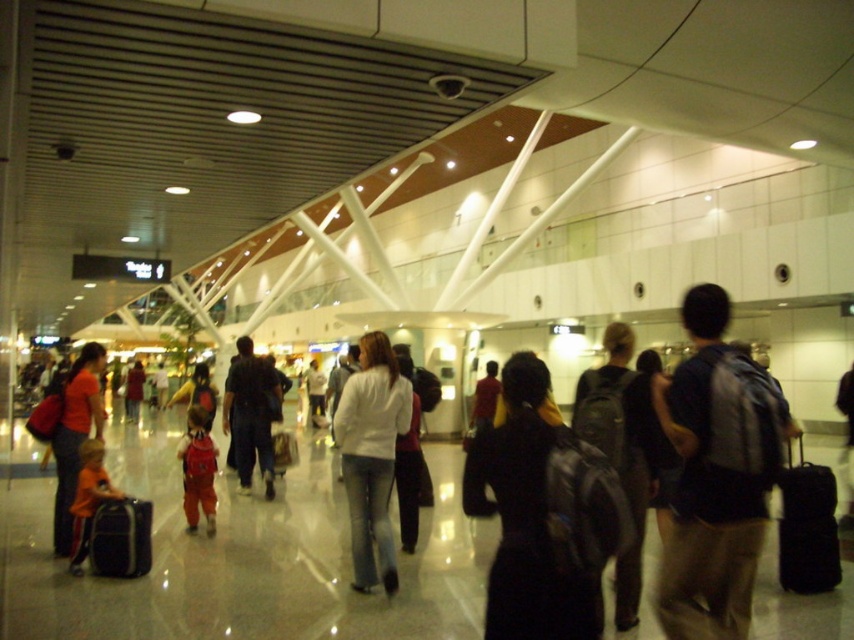
You are a traveler standing at the entrance of the airport terminal and see a white matte jacket at center and a matte black backpack at center. Which item is closer to you?

The white matte jacket at center is closer to you because it is further to the viewer than the matte black backpack at center.

Consider the image. You are a traveler trying to decide whether to wear your white matte jacket at center over your matte black backpack at center. Based on their sizes, which one is wider?

The white matte jacket at center is wider than the matte black backpack at center.